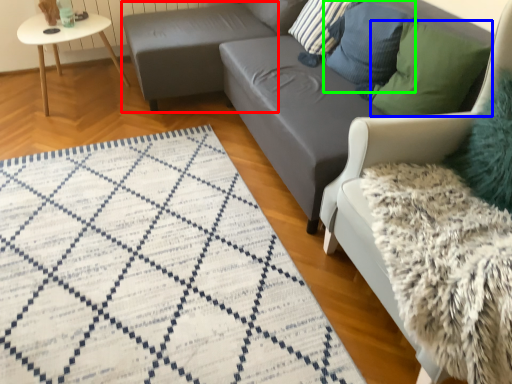
Question: Which is nearer to the footrest (highlighted by a red box)? pillow (highlighted by a blue box) or pillow (highlighted by a green box).

Choices:
 (A) pillow
 (B) pillow

Answer: (B)